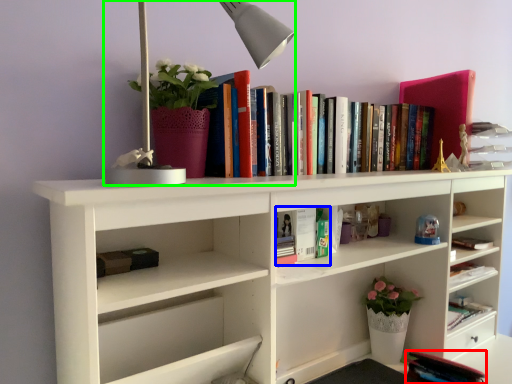
Question: Which is nearer to the book (highlighted by a red box)? book (highlighted by a blue box) or table lamp (highlighted by a green box).

Choices:
 (A) book
 (B) table lamp

Answer: (A)